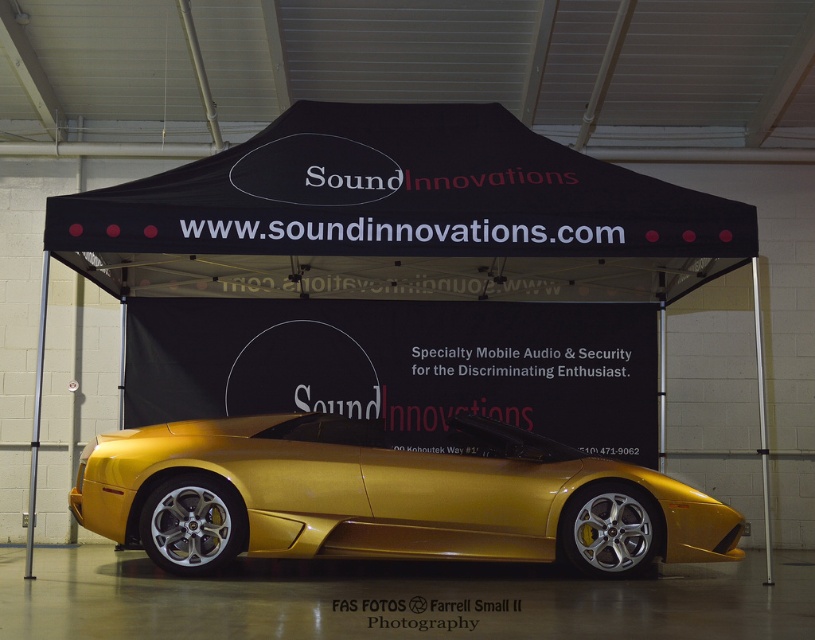
Who is shorter, black fabric tent at center or gold metallic sports car at center?

With less height is black fabric tent at center.

At what (x,y) coordinates should I click in order to perform the action: click on black fabric tent at center. Please return your answer as a coordinate pair (x, y). Image resolution: width=815 pixels, height=640 pixels. Looking at the image, I should click on (394, 220).

Where is `black fabric tent at center`? black fabric tent at center is located at coordinates (394, 220).